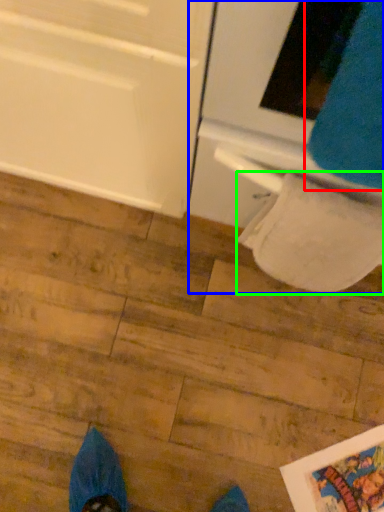
Question: Based on their relative distances, which object is nearer to sweat pant (highlighted by a red box)? Choose from oven (highlighted by a blue box) and toilet paper (highlighted by a green box).

Choices:
 (A) oven
 (B) toilet paper

Answer: (A)